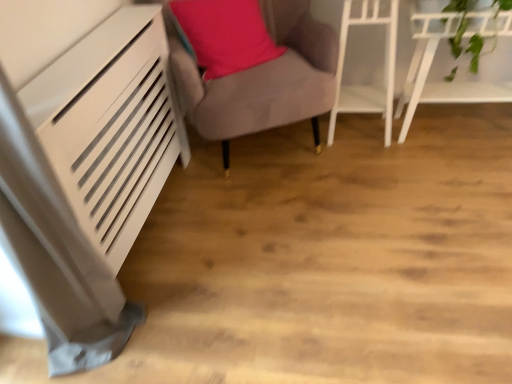
Identify the location of velvet grey armchair at center, which is counted as the first furniture, starting from the left. The image size is (512, 384). (262, 77).

This screenshot has height=384, width=512. Identify the location of matte pink pillow at center. (224, 35).

Is matte pink pillow at center behind white glossy shelf at upper right, acting as the second furniture starting from the right?

No.

From a real-world perspective, which is physically above, matte pink pillow at center or white glossy shelf at upper right, acting as the second furniture starting from the right?

matte pink pillow at center, from a real-world perspective.

Is matte pink pillow at center not within white glossy shelf at upper right, the second furniture positioned from the left?

Absolutely, matte pink pillow at center is external to white glossy shelf at upper right, the second furniture positioned from the left.

Could you measure the distance between matte pink pillow at center and white glossy shelf at upper right, the second furniture positioned from the left?

matte pink pillow at center is 22.59 inches away from white glossy shelf at upper right, the second furniture positioned from the left.

Is white glossy shelf at upper right, the second furniture positioned from the left, positioned beyond the bounds of white glossy shelf at upper right, which appears as the first furniture when viewed from the right?

Indeed, white glossy shelf at upper right, the second furniture positioned from the left, is completely outside white glossy shelf at upper right, which appears as the first furniture when viewed from the right.

From a real-world perspective, does white glossy shelf at upper right, the second furniture positioned from the left, sit lower than white glossy shelf at upper right, which appears as the first furniture when viewed from the right?

Incorrect, from a real-world perspective, white glossy shelf at upper right, the second furniture positioned from the left, is higher than white glossy shelf at upper right, which appears as the first furniture when viewed from the right.

Is white glossy shelf at upper right, acting as the second furniture starting from the right, positioned with its back to white glossy shelf at upper right, placed as the third furniture when sorted from left to right?

No.

Does white glossy shelf at upper right, the second furniture positioned from the left, have a larger size compared to white glossy shelf at upper right, placed as the third furniture when sorted from left to right?

Actually, white glossy shelf at upper right, the second furniture positioned from the left, might be smaller than white glossy shelf at upper right, placed as the third furniture when sorted from left to right.

How different are the orientations of matte pink pillow at center and velvet grey armchair at center, the third furniture in the right-to-left sequence, in degrees?

They differ by 11.8 degrees in their facing directions.

From a real-world perspective, is matte pink pillow at center over velvet grey armchair at center, which is counted as the first furniture, starting from the left?

Correct, in the physical world, matte pink pillow at center is higher than velvet grey armchair at center, which is counted as the first furniture, starting from the left.

The width and height of the screenshot is (512, 384). Find the location of `pillow above the velvet grey armchair at center, which is counted as the first furniture, starting from the left (from the image's perspective)`. pillow above the velvet grey armchair at center, which is counted as the first furniture, starting from the left (from the image's perspective) is located at coordinates (224, 35).

From the image's perspective, which one is positioned higher, matte pink pillow at center or velvet grey armchair at center, the third furniture in the right-to-left sequence?

matte pink pillow at center.

From a real-world perspective, between velvet grey armchair at center, which is counted as the first furniture, starting from the left, and white glossy shelf at upper right, placed as the third furniture when sorted from left to right, who is vertically higher?

In real-world perspective, velvet grey armchair at center, which is counted as the first furniture, starting from the left, is above.

Do you think velvet grey armchair at center, which is counted as the first furniture, starting from the left, is within white glossy shelf at upper right, which appears as the first furniture when viewed from the right, or outside of it?

velvet grey armchair at center, which is counted as the first furniture, starting from the left, exists outside the volume of white glossy shelf at upper right, which appears as the first furniture when viewed from the right.

Which point is more forward, (173, 68) or (415, 35)?

The point (173, 68) is in front.

In the image, is velvet grey armchair at center, the third furniture in the right-to-left sequence, on the left side or the right side of white glossy shelf at upper right, which appears as the first furniture when viewed from the right?

In the image, velvet grey armchair at center, the third furniture in the right-to-left sequence, appears on the left side of white glossy shelf at upper right, which appears as the first furniture when viewed from the right.

Is point (186, 67) positioned behind point (243, 61)?

That is False.

From a real-world perspective, relative to matte pink pillow at center, is velvet grey armchair at center, the third furniture in the right-to-left sequence, vertically above or below?

velvet grey armchair at center, the third furniture in the right-to-left sequence, is below matte pink pillow at center.

Is velvet grey armchair at center, which is counted as the first furniture, starting from the left, facing away from matte pink pillow at center?

Yes, velvet grey armchair at center, which is counted as the first furniture, starting from the left,'s orientation is away from matte pink pillow at center.

Considering the sizes of velvet grey armchair at center, the third furniture in the right-to-left sequence, and matte pink pillow at center in the image, is velvet grey armchair at center, the third furniture in the right-to-left sequence, wider or thinner than matte pink pillow at center?

In the image, velvet grey armchair at center, the third furniture in the right-to-left sequence, appears to be wider than matte pink pillow at center.

From the picture: How far apart are velvet grey armchair at center, the third furniture in the right-to-left sequence, and white glossy shelf at upper right, the second furniture positioned from the left?

The distance of velvet grey armchair at center, the third furniture in the right-to-left sequence, from white glossy shelf at upper right, the second furniture positioned from the left, is 14.99 inches.

Is velvet grey armchair at center, which is counted as the first furniture, starting from the left, next to white glossy shelf at upper right, the second furniture positioned from the left?

No.

Would you say velvet grey armchair at center, the third furniture in the right-to-left sequence, is outside white glossy shelf at upper right, acting as the second furniture starting from the right?

Yes, velvet grey armchair at center, the third furniture in the right-to-left sequence, is not within white glossy shelf at upper right, acting as the second furniture starting from the right.

From a real-world perspective, is velvet grey armchair at center, which is counted as the first furniture, starting from the left, located higher than white glossy shelf at upper right, acting as the second furniture starting from the right?

Yes.

From a real-world perspective, does white glossy shelf at upper right, placed as the third furniture when sorted from left to right, sit lower than matte pink pillow at center?

Yes.

Is white glossy shelf at upper right, placed as the third furniture when sorted from left to right, turned away from matte pink pillow at center?

No, matte pink pillow at center is not at the back of white glossy shelf at upper right, placed as the third furniture when sorted from left to right.

Could matte pink pillow at center be considered to be inside white glossy shelf at upper right, which appears as the first furniture when viewed from the right?

Definitely not — matte pink pillow at center is not inside white glossy shelf at upper right, which appears as the first furniture when viewed from the right.

What are the coordinates of `the 2nd furniture below the matte pink pillow at center (from the image's perspective)` in the screenshot? It's located at (364, 85).

This screenshot has height=384, width=512. What are the coordinates of `furniture directly beneath the white glossy shelf at upper right, acting as the second furniture starting from the right (from a real-world perspective)` in the screenshot? It's located at (429, 69).

When comparing their distances from matte pink pillow at center, does white glossy shelf at upper right, acting as the second furniture starting from the right, or velvet grey armchair at center, the third furniture in the right-to-left sequence, seem further?

Among the two, white glossy shelf at upper right, acting as the second furniture starting from the right, is located further to matte pink pillow at center.

From the image, which object appears to be farther from white glossy shelf at upper right, acting as the second furniture starting from the right, white glossy shelf at upper right, placed as the third furniture when sorted from left to right, or matte pink pillow at center?

matte pink pillow at center is positioned further to the anchor white glossy shelf at upper right, acting as the second furniture starting from the right.

Looking at the image, which one is located further to matte pink pillow at center, velvet grey armchair at center, which is counted as the first furniture, starting from the left, or white glossy shelf at upper right, acting as the second furniture starting from the right?

white glossy shelf at upper right, acting as the second furniture starting from the right.

Which object lies nearer to the anchor point white glossy shelf at upper right, the second furniture positioned from the left, matte pink pillow at center or velvet grey armchair at center, the third furniture in the right-to-left sequence?

The object closer to white glossy shelf at upper right, the second furniture positioned from the left, is velvet grey armchair at center, the third furniture in the right-to-left sequence.

Considering their positions, is white glossy shelf at upper right, placed as the third furniture when sorted from left to right, positioned further to matte pink pillow at center than velvet grey armchair at center, which is counted as the first furniture, starting from the left?

white glossy shelf at upper right, placed as the third furniture when sorted from left to right, lies further to matte pink pillow at center than the other object.

Based on their spatial positions, is matte pink pillow at center or white glossy shelf at upper right, placed as the third furniture when sorted from left to right, closer to white glossy shelf at upper right, acting as the second furniture starting from the right?

white glossy shelf at upper right, placed as the third furniture when sorted from left to right.

Looking at the image, which one is located further to white glossy shelf at upper right, acting as the second furniture starting from the right, white glossy shelf at upper right, which appears as the first furniture when viewed from the right, or velvet grey armchair at center, the third furniture in the right-to-left sequence?

velvet grey armchair at center, the third furniture in the right-to-left sequence, lies further to white glossy shelf at upper right, acting as the second furniture starting from the right, than the other object.

Considering their positions, is white glossy shelf at upper right, acting as the second furniture starting from the right, positioned further to white glossy shelf at upper right, which appears as the first furniture when viewed from the right, than velvet grey armchair at center, which is counted as the first furniture, starting from the left?

Based on the image, velvet grey armchair at center, which is counted as the first furniture, starting from the left, appears to be further to white glossy shelf at upper right, which appears as the first furniture when viewed from the right.

Locate an element on the screen. The image size is (512, 384). furniture located between matte pink pillow at center and white glossy shelf at upper right, acting as the second furniture starting from the right, in the left-right direction is located at coordinates (262, 77).

The image size is (512, 384). I want to click on furniture between velvet grey armchair at center, which is counted as the first furniture, starting from the left, and white glossy shelf at upper right, which appears as the first furniture when viewed from the right, so click(364, 85).